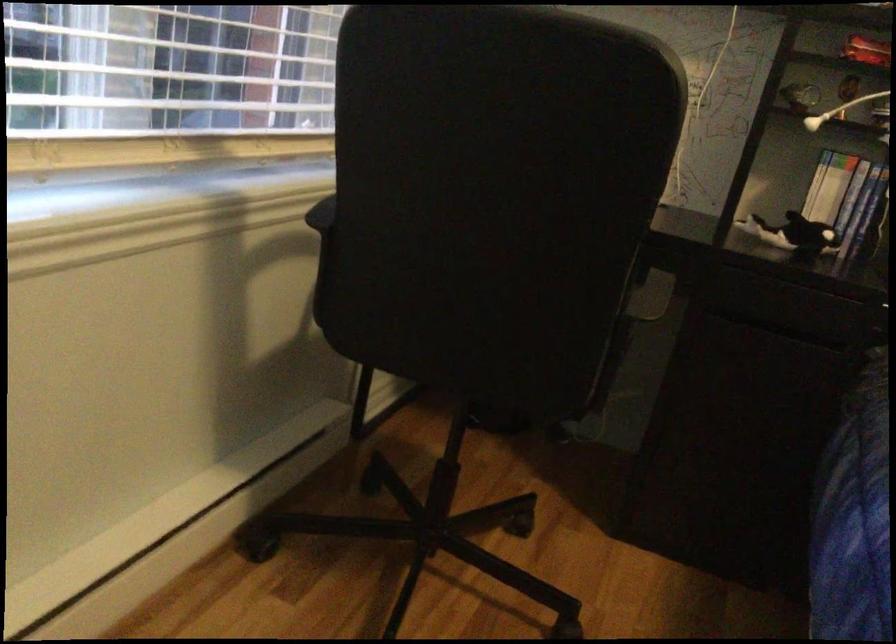
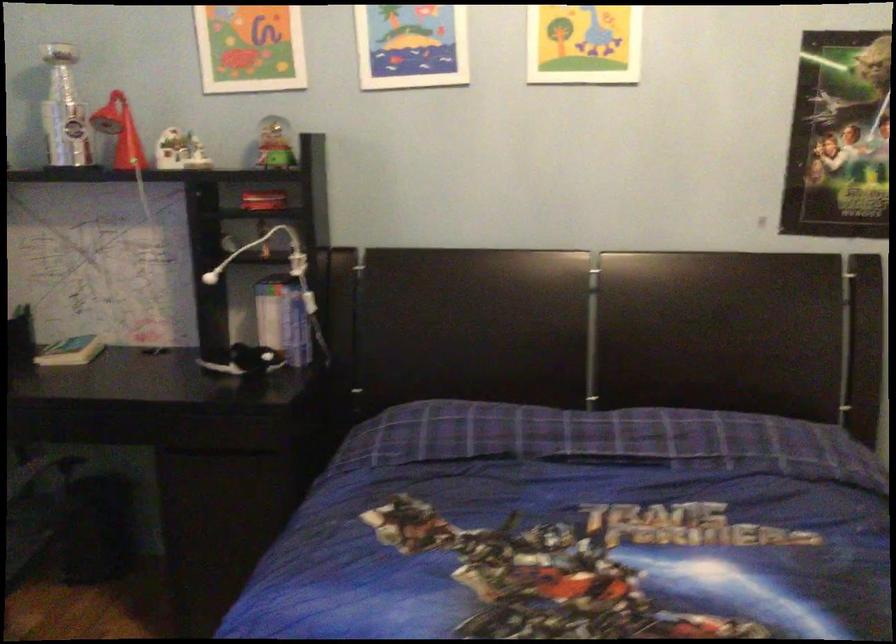
Question: The images are taken continuously from a first-person perspective. In which direction is your viewpoint rotating?

Choices:
 (A) Left
 (B) Right
 (C) Up
 (D) Down

Answer: (B)